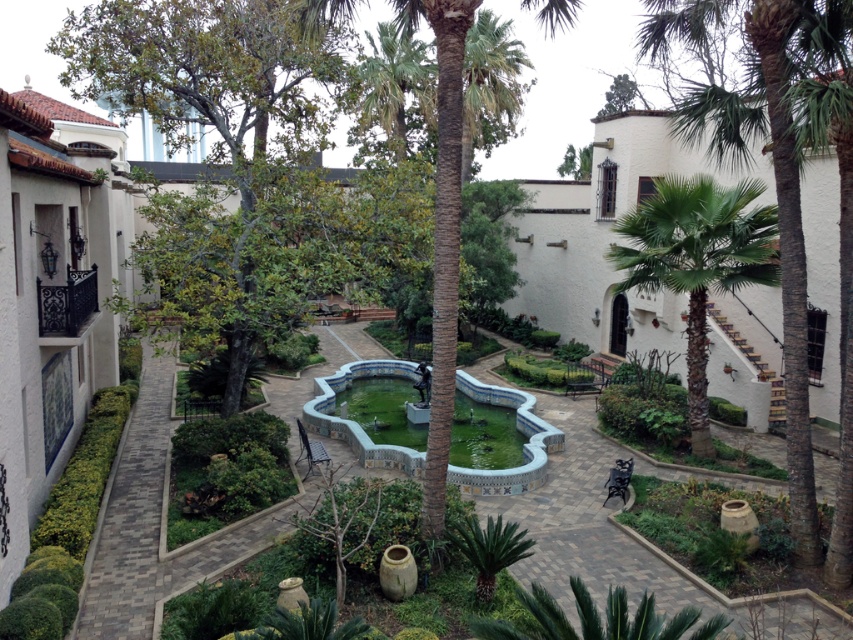
Question: Which object is farther from the camera taking this photo?

Choices:
 (A) blue mosaic water at center
 (B) green leafy palm tree at right
 (C) green leafy tree at left

Answer: (B)

Question: Which is farther from the green leafy palm tree at right?

Choices:
 (A) green leafy tree at left
 (B) blue mosaic water at center

Answer: (A)

Question: Is green leafy tree at left below blue mosaic water at center?

Choices:
 (A) no
 (B) yes

Answer: (A)

Question: Observing the image, what is the correct spatial positioning of green leafy tree at left in reference to green leafy palm tree at right?

Choices:
 (A) left
 (B) right

Answer: (A)

Question: Among these objects, which one is farthest from the camera?

Choices:
 (A) green leafy palm tree at right
 (B) blue mosaic water at center

Answer: (A)

Question: From the image, what is the correct spatial relationship of green leafy palm tree at right in relation to blue mosaic water at center?

Choices:
 (A) left
 (B) right

Answer: (B)